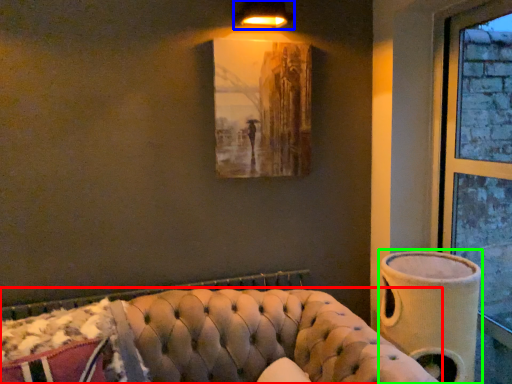
Question: Considering the real-world distances, which object is farthest from studio couch (highlighted by a red box)? lamp (highlighted by a blue box) or vase (highlighted by a green box)?

Choices:
 (A) lamp
 (B) vase

Answer: (A)